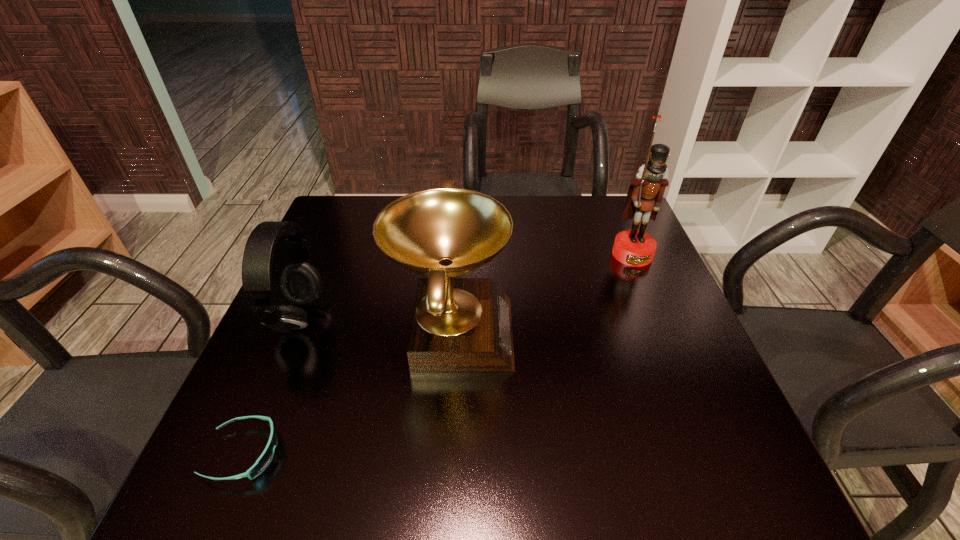
You are a GUI agent. You are given a task and a screenshot of the screen. Output one action in this format:
    pyautogui.click(x=<x>, y=<y>)
    Task: Click on the tallest object
    This screenshot has width=960, height=540.
    Given the screenshot: What is the action you would take?
    pyautogui.click(x=632, y=247)

Where is `nutcracker`? The height and width of the screenshot is (540, 960). nutcracker is located at coordinates (632, 247).

At what (x,y) coordinates should I click in order to perform the action: click on the third object from left to right. Please return your answer as a coordinate pair (x, y). Looking at the image, I should click on (458, 324).

I want to click on the second shortest object, so click(301, 284).

Image resolution: width=960 pixels, height=540 pixels. I want to click on sunglasses, so click(263, 461).

Where is `the shortest object`? the shortest object is located at coordinates (263, 461).

This screenshot has height=540, width=960. I want to click on free space located on the front-facing side of the tallest object, so click(x=643, y=280).

The height and width of the screenshot is (540, 960). I want to click on free space located on the front-facing side of the award, so click(x=536, y=330).

Where is `vacant space positioned 0.360m on the ear cups of the earphone`? The image size is (960, 540). vacant space positioned 0.360m on the ear cups of the earphone is located at coordinates (484, 319).

Where is `vacant point located 0.190m on the front-facing side of the shortest object`? This screenshot has width=960, height=540. vacant point located 0.190m on the front-facing side of the shortest object is located at coordinates (393, 454).